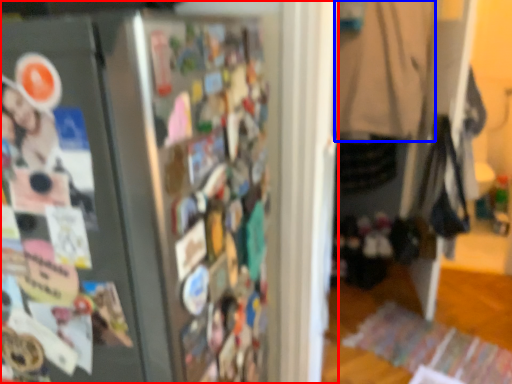
Question: Which object appears farthest to the camera in this image, refrigerator (highlighted by a red box) or clothing (highlighted by a blue box)?

Choices:
 (A) refrigerator
 (B) clothing

Answer: (B)